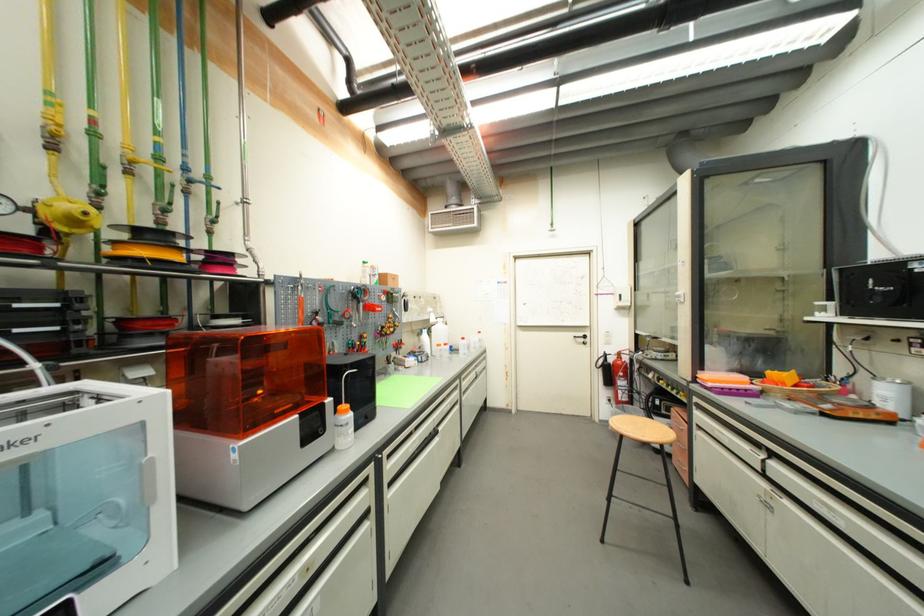
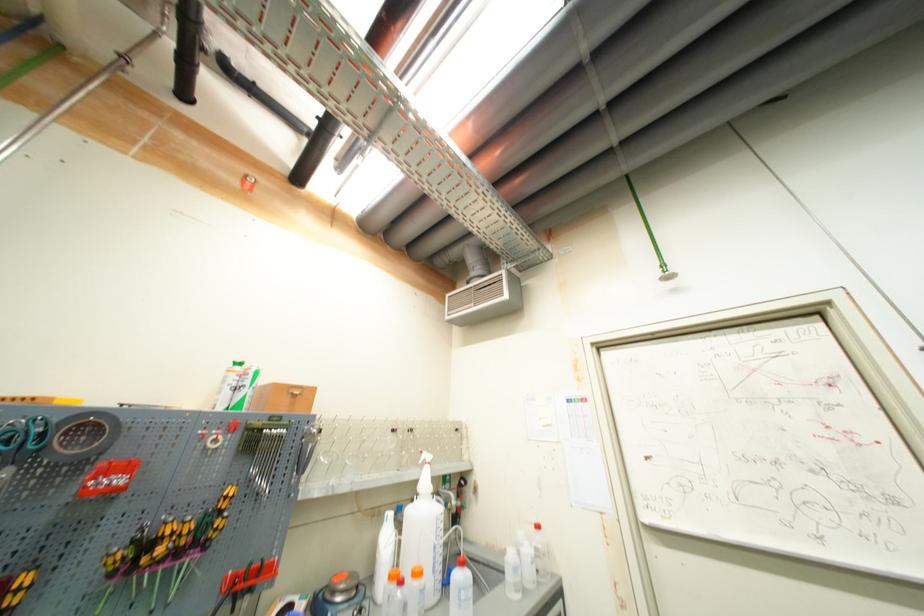
Locate, in the second image, the point that corresponds to (434,322) in the first image.

(421, 484)